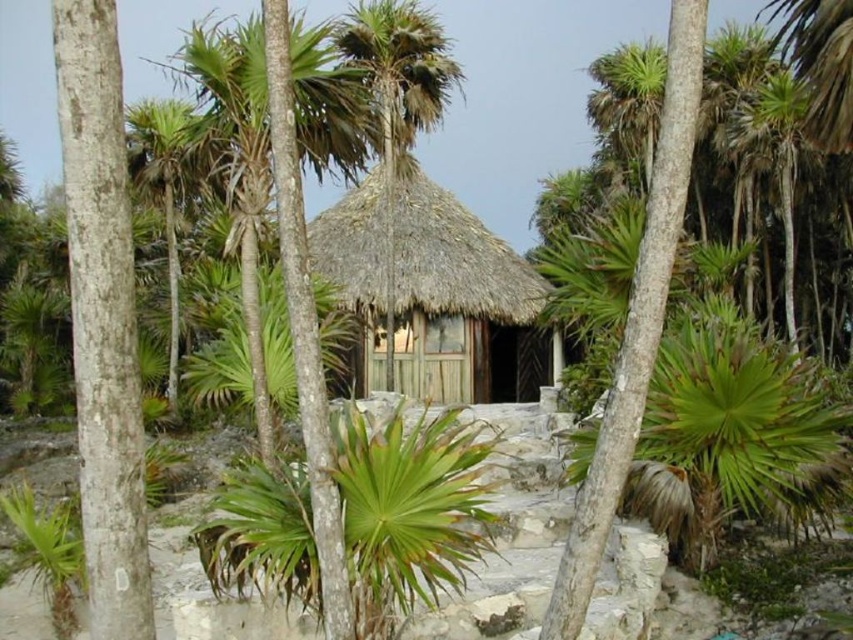
Question: Is thatched wood hut at center positioned behind green leafy palm tree at center?

Choices:
 (A) no
 (B) yes

Answer: (B)

Question: Among these objects, which one is nearest to the camera?

Choices:
 (A) thatched wood hut at center
 (B) white smooth tree trunk at left
 (C) green leafy palm tree at center
 (D) green leafy palm tree at upper left

Answer: (B)

Question: Among these points, which one is farthest from the camera?

Choices:
 (A) (158, 129)
 (B) (151, 637)
 (C) (431, 61)
 (D) (480, 387)

Answer: (D)

Question: Can you confirm if green leafy palm tree at center is thinner than green leafy palm tree at upper left?

Choices:
 (A) no
 (B) yes

Answer: (B)

Question: Can you confirm if green leafy palm tree at center is positioned above green leafy palm tree at upper left?

Choices:
 (A) no
 (B) yes

Answer: (B)

Question: Which of the following is the farthest from the observer?

Choices:
 (A) green leafy palm tree at center
 (B) white smooth tree trunk at left
 (C) thatched wood hut at center

Answer: (C)